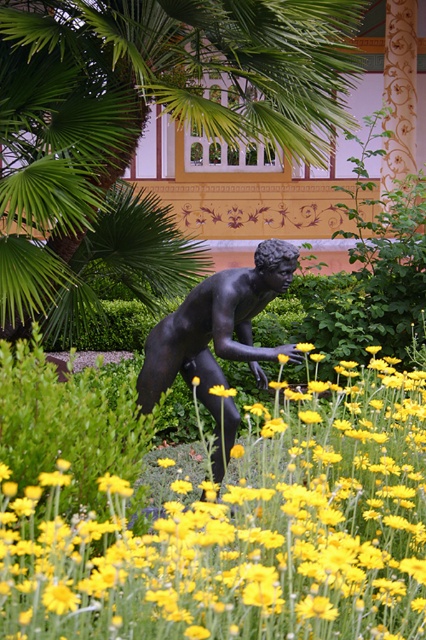
Question: Which of the following is the farthest from the observer?

Choices:
 (A) bronze statue at center
 (B) yellow matte flower at center

Answer: (A)

Question: Which point is farther to the camera?

Choices:
 (A) (270, 452)
 (B) (267, 268)

Answer: (A)

Question: Can you confirm if yellow matte flower at center is wider than bronze statue at center?

Choices:
 (A) yes
 (B) no

Answer: (A)

Question: Does yellow matte flower at center appear on the right side of bronze statue at center?

Choices:
 (A) yes
 (B) no

Answer: (A)

Question: Among these points, which one is nearest to the camera?

Choices:
 (A) (170, 333)
 (B) (103, 580)

Answer: (B)

Question: Is yellow matte flower at center to the right of bronze statue at center from the viewer's perspective?

Choices:
 (A) yes
 (B) no

Answer: (A)